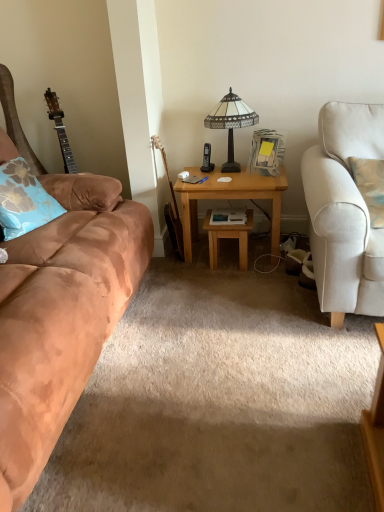
Question: From their relative heights in the image, would you say wooden desk at center is taller or shorter than wooden acoustic guitar at center?

Choices:
 (A) tall
 (B) short

Answer: (B)

Question: From the image's perspective, relative to wooden acoustic guitar at center, is wooden desk at center above or below?

Choices:
 (A) above
 (B) below

Answer: (B)

Question: Which of these objects is positioned closest to the suede brown couch at left?

Choices:
 (A) wooden table at center
 (B) blue floral pillow at left
 (C) stained glass lamp at center
 (D) wooden acoustic guitar at center
 (E) wooden desk at center

Answer: (B)

Question: Estimate the real-world distances between objects in this image. Which object is farther from the stained glass lamp at center?

Choices:
 (A) wooden acoustic guitar at center
 (B) wooden table at center
 (C) suede brown couch at left
 (D) wooden desk at center
 (E) blue floral pillow at left

Answer: (C)